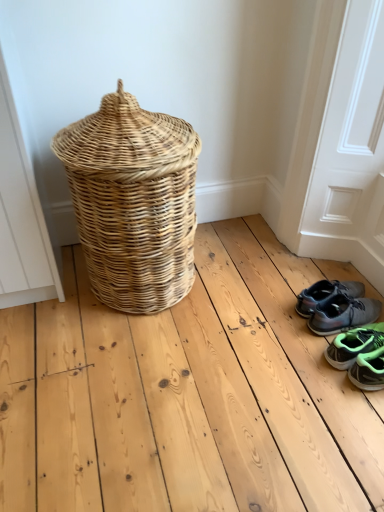
Measure the distance between neon green synthetic sneakers at lower right, marked as the 1th footwear in a front-to-back arrangement, and camera.

neon green synthetic sneakers at lower right, marked as the 1th footwear in a front-to-back arrangement, is 1.36 meters away from camera.

This screenshot has height=512, width=384. Describe the element at coordinates (133, 201) in the screenshot. I see `natural wicker basket at left` at that location.

Identify the location of neon green synthetic sneakers at lower right, marked as the 1th footwear in a front-to-back arrangement. (368, 370).

Which of these two, neon green synthetic sneakers at lower right, arranged as the third footwear when viewed from the back, or gray synthetic sneakers at lower right, which is the 3th footwear from front to back, stands taller?

With more height is gray synthetic sneakers at lower right, which is the 3th footwear from front to back.

From the image's perspective, who appears lower, neon green synthetic sneakers at lower right, arranged as the third footwear when viewed from the back, or gray synthetic sneakers at lower right, which is the 3th footwear from front to back?

From the image's view, neon green synthetic sneakers at lower right, arranged as the third footwear when viewed from the back, is below.

From a real-world perspective, who is located lower, neon green synthetic sneakers at lower right, marked as the 1th footwear in a front-to-back arrangement, or gray synthetic sneakers at lower right, positioned as the first footwear in back-to-front order?

neon green synthetic sneakers at lower right, marked as the 1th footwear in a front-to-back arrangement.

Considering the positions of objects natural wicker basket at left and gray fabric sneakers at lower right, which appears as the second footwear when viewed from the back, in the image provided, who is behind, natural wicker basket at left or gray fabric sneakers at lower right, which appears as the second footwear when viewed from the back,?

Positioned behind is gray fabric sneakers at lower right, which appears as the second footwear when viewed from the back.

Which is correct: natural wicker basket at left is inside gray fabric sneakers at lower right, which appears as the second footwear when viewed from the back, or outside of it?

natural wicker basket at left is not enclosed by gray fabric sneakers at lower right, which appears as the second footwear when viewed from the back.

In the scene shown: From the image's perspective, is natural wicker basket at left above or below gray fabric sneakers at lower right, which is counted as the 2th footwear, starting from the front?

From the image's perspective, natural wicker basket at left appears above gray fabric sneakers at lower right, which is counted as the 2th footwear, starting from the front.

Based on the photo, from a real-world perspective, between natural wicker basket at left and gray fabric sneakers at lower right, which appears as the second footwear when viewed from the back, who is vertically lower?

gray fabric sneakers at lower right, which appears as the second footwear when viewed from the back, from a real-world perspective.

Does white matte screen door at lower right have a lesser height compared to gray fabric sneakers at lower right, which appears as the second footwear when viewed from the back?

In fact, white matte screen door at lower right may be taller than gray fabric sneakers at lower right, which appears as the second footwear when viewed from the back.

Identify the location of the 2nd footwear behind the white matte screen door at lower right. (354, 345).

Between white matte screen door at lower right and gray fabric sneakers at lower right, which appears as the second footwear when viewed from the back, which one appears on the left side from the viewer's perspective?

Positioned to the left is white matte screen door at lower right.

Could you measure the distance between white matte screen door at lower right and gray fabric sneakers at lower right, which appears as the second footwear when viewed from the back?

The distance of white matte screen door at lower right from gray fabric sneakers at lower right, which appears as the second footwear when viewed from the back, is 55.60 centimeters.

Can we say white matte screen door at lower right lies outside gray synthetic sneakers at lower right, which is the 3th footwear from front to back?

white matte screen door at lower right lies outside gray synthetic sneakers at lower right, which is the 3th footwear from front to back,'s area.

Considering the relative sizes of white matte screen door at lower right and gray synthetic sneakers at lower right, which is the 3th footwear from front to back, in the image provided, is white matte screen door at lower right bigger than gray synthetic sneakers at lower right, which is the 3th footwear from front to back,?

Indeed, white matte screen door at lower right has a larger size compared to gray synthetic sneakers at lower right, which is the 3th footwear from front to back.

Which of these two, white matte screen door at lower right or gray synthetic sneakers at lower right, which is the 3th footwear from front to back, stands taller?

With more height is white matte screen door at lower right.

Can you confirm if white matte screen door at lower right is thinner than gray synthetic sneakers at lower right, which is the 3th footwear from front to back?

Correct, the width of white matte screen door at lower right is less than that of gray synthetic sneakers at lower right, which is the 3th footwear from front to back.

Considering the sizes of objects natural wicker basket at left and white matte screen door at lower right in the image provided, who is smaller, natural wicker basket at left or white matte screen door at lower right?

With smaller size is white matte screen door at lower right.

From a real-world perspective, does natural wicker basket at left sit lower than white matte screen door at lower right?

Yes, from a real-world perspective, natural wicker basket at left is below white matte screen door at lower right.

From the image's perspective, is natural wicker basket at left located above white matte screen door at lower right?

Actually, natural wicker basket at left appears below white matte screen door at lower right in the image.

In the scene shown: Considering the positions of objects natural wicker basket at left and white matte screen door at lower right in the image provided, who is more to the left, natural wicker basket at left or white matte screen door at lower right?

From the viewer's perspective, natural wicker basket at left appears more on the left side.

Locate an element on the screen. Image resolution: width=384 pixels, height=512 pixels. picnic basket that is above the gray fabric sneakers at lower right, which appears as the second footwear when viewed from the back (from the image's perspective) is located at coordinates (133, 201).

Measure the distance from gray fabric sneakers at lower right, which is counted as the 2th footwear, starting from the front, to natural wicker basket at left.

They are 32.38 inches apart.

Can you tell me how much gray fabric sneakers at lower right, which appears as the second footwear when viewed from the back, and natural wicker basket at left differ in facing direction?

The facing directions of gray fabric sneakers at lower right, which appears as the second footwear when viewed from the back, and natural wicker basket at left are 84.4 degrees apart.

Is gray fabric sneakers at lower right, which appears as the second footwear when viewed from the back, shorter than natural wicker basket at left?

Yes.

Can we say gray fabric sneakers at lower right, which is counted as the 2th footwear, starting from the front, lies outside white matte screen door at lower right?

gray fabric sneakers at lower right, which is counted as the 2th footwear, starting from the front, is positioned outside white matte screen door at lower right.

Considering the positions of points (343, 347) and (363, 161), is point (343, 347) farther from camera compared to point (363, 161)?

No, it is in front of (363, 161).

Which of these two, gray fabric sneakers at lower right, which appears as the second footwear when viewed from the back, or white matte screen door at lower right, stands shorter?

gray fabric sneakers at lower right, which appears as the second footwear when viewed from the back, is shorter.

At what (x,y) coordinates should I click in order to perform the action: click on screen door that appears on the left of gray fabric sneakers at lower right, which appears as the second footwear when viewed from the back. Please return your answer as a coordinate pair (x, y). This screenshot has height=512, width=384. Looking at the image, I should click on (351, 151).

Find the location of a particular element. the 2nd footwear to the right of the gray synthetic sneakers at lower right, which is the 3th footwear from front to back, starting your count from the anchor is located at coordinates (368, 370).

The width and height of the screenshot is (384, 512). I want to click on picnic basket on the left of gray fabric sneakers at lower right, which is counted as the 2th footwear, starting from the front, so click(x=133, y=201).

Looking at the image, which one is located closer to gray fabric sneakers at lower right, which is counted as the 2th footwear, starting from the front, gray synthetic sneakers at lower right, positioned as the first footwear in back-to-front order, or white matte screen door at lower right?

gray synthetic sneakers at lower right, positioned as the first footwear in back-to-front order.

When comparing their distances from neon green synthetic sneakers at lower right, arranged as the third footwear when viewed from the back, does gray fabric sneakers at lower right, which appears as the second footwear when viewed from the back, or white matte screen door at lower right seem further?

white matte screen door at lower right is positioned further to the anchor neon green synthetic sneakers at lower right, arranged as the third footwear when viewed from the back.

Considering their positions, is neon green synthetic sneakers at lower right, marked as the 1th footwear in a front-to-back arrangement, positioned further to gray synthetic sneakers at lower right, positioned as the first footwear in back-to-front order, than natural wicker basket at left?

Based on the image, natural wicker basket at left appears to be further to gray synthetic sneakers at lower right, positioned as the first footwear in back-to-front order.

Based on the photo, looking at the image, which one is located closer to gray fabric sneakers at lower right, which appears as the second footwear when viewed from the back, white matte screen door at lower right or gray synthetic sneakers at lower right, positioned as the first footwear in back-to-front order?

Among the two, gray synthetic sneakers at lower right, positioned as the first footwear in back-to-front order, is located nearer to gray fabric sneakers at lower right, which appears as the second footwear when viewed from the back.

From the image, which object appears to be nearer to natural wicker basket at left, gray fabric sneakers at lower right, which appears as the second footwear when viewed from the back, or neon green synthetic sneakers at lower right, arranged as the third footwear when viewed from the back?

gray fabric sneakers at lower right, which appears as the second footwear when viewed from the back, lies closer to natural wicker basket at left than the other object.

When comparing their distances from gray fabric sneakers at lower right, which is counted as the 2th footwear, starting from the front, does gray synthetic sneakers at lower right, which is the 3th footwear from front to back, or natural wicker basket at left seem closer?

Based on the image, gray synthetic sneakers at lower right, which is the 3th footwear from front to back, appears to be nearer to gray fabric sneakers at lower right, which is counted as the 2th footwear, starting from the front.

From the image, which object appears to be nearer to white matte screen door at lower right, natural wicker basket at left or gray synthetic sneakers at lower right, positioned as the first footwear in back-to-front order?

The object closer to white matte screen door at lower right is gray synthetic sneakers at lower right, positioned as the first footwear in back-to-front order.

Based on their spatial positions, is neon green synthetic sneakers at lower right, arranged as the third footwear when viewed from the back, or white matte screen door at lower right further from natural wicker basket at left?

neon green synthetic sneakers at lower right, arranged as the third footwear when viewed from the back, is further to natural wicker basket at left.

Locate an element on the screen. Image resolution: width=384 pixels, height=512 pixels. screen door located between natural wicker basket at left and neon green synthetic sneakers at lower right, arranged as the third footwear when viewed from the back, in the left-right direction is located at coordinates (351, 151).

Image resolution: width=384 pixels, height=512 pixels. In order to click on footwear between neon green synthetic sneakers at lower right, marked as the 1th footwear in a front-to-back arrangement, and gray synthetic sneakers at lower right, which is the 3th footwear from front to back, along the z-axis in this screenshot , I will do tap(354, 345).

Find the location of a particular element. footwear between natural wicker basket at left and gray fabric sneakers at lower right, which is counted as the 2th footwear, starting from the front, in the horizontal direction is located at coordinates (343, 314).

Find the location of a particular element. This screenshot has width=384, height=512. screen door between natural wicker basket at left and gray synthetic sneakers at lower right, positioned as the first footwear in back-to-front order, from left to right is located at coordinates (351, 151).